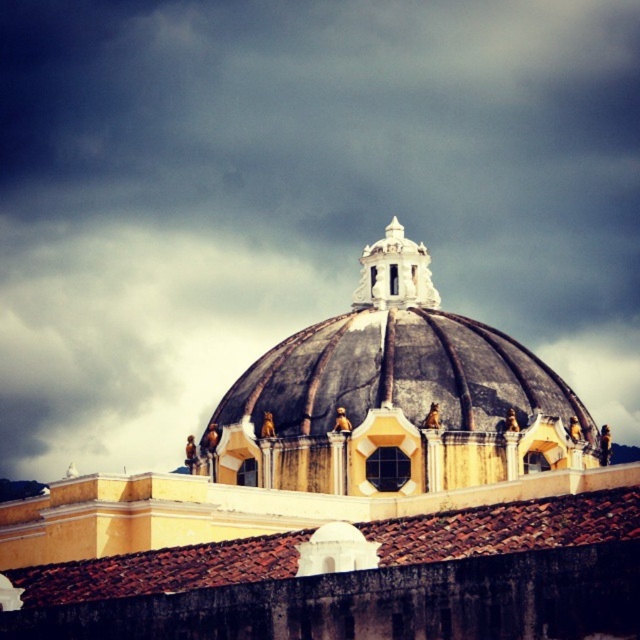
Question: Which point is farther to the camera?

Choices:
 (A) brown tile roof at center
 (B) white stone spire at center

Answer: (B)

Question: Does smooth yellow dome at center have a greater width compared to brown tile roof at center?

Choices:
 (A) yes
 (B) no

Answer: (A)

Question: Which of the following is the closest to the observer?

Choices:
 (A) (380, 273)
 (B) (525, 564)
 (C) (586, 506)

Answer: (B)

Question: Estimate the real-world distances between objects in this image. Which object is farther from the white stone spire at center?

Choices:
 (A) smooth yellow dome at center
 (B) brown tile roof at center
 (C) dark gray stone dome at center

Answer: (B)

Question: In this image, where is dark gray stone dome at center located relative to brown tile roof at center?

Choices:
 (A) right
 (B) left

Answer: (A)

Question: Is smooth yellow dome at center positioned behind dark gray stone dome at center?

Choices:
 (A) yes
 (B) no

Answer: (B)